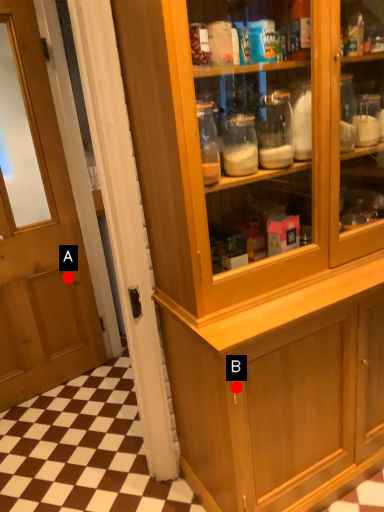
Question: Two points are circled on the image, labeled by A and B beside each circle. Which of the following is the farthest from the observer?

Choices:
 (A) A is further
 (B) B is further

Answer: (A)